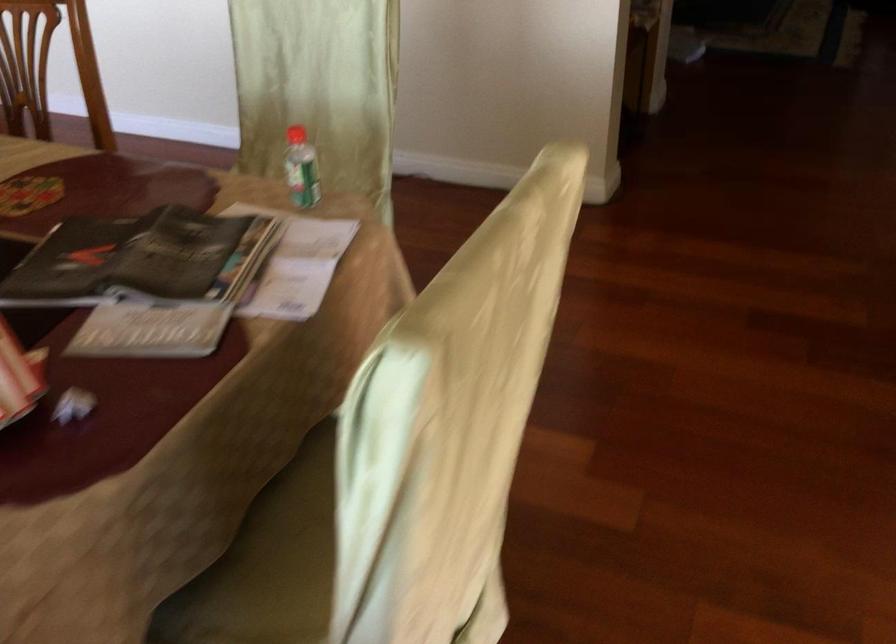
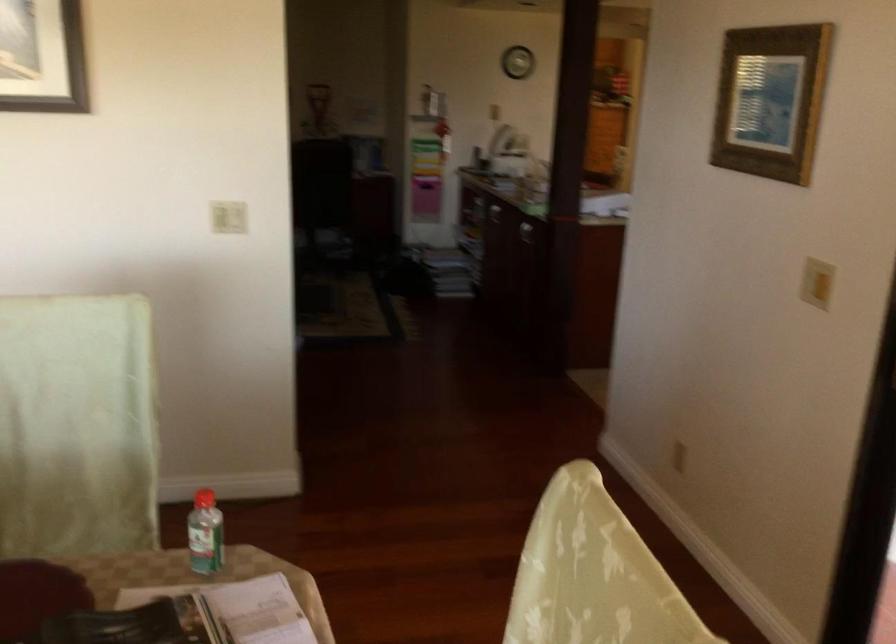
Where in the second image is the point corresponding to [295,128] from the first image?

(203, 498)